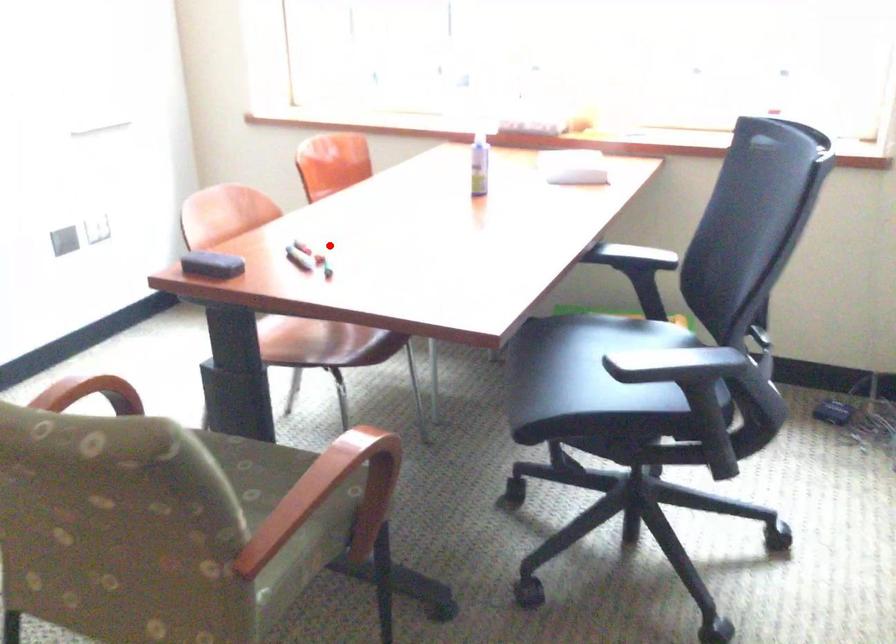
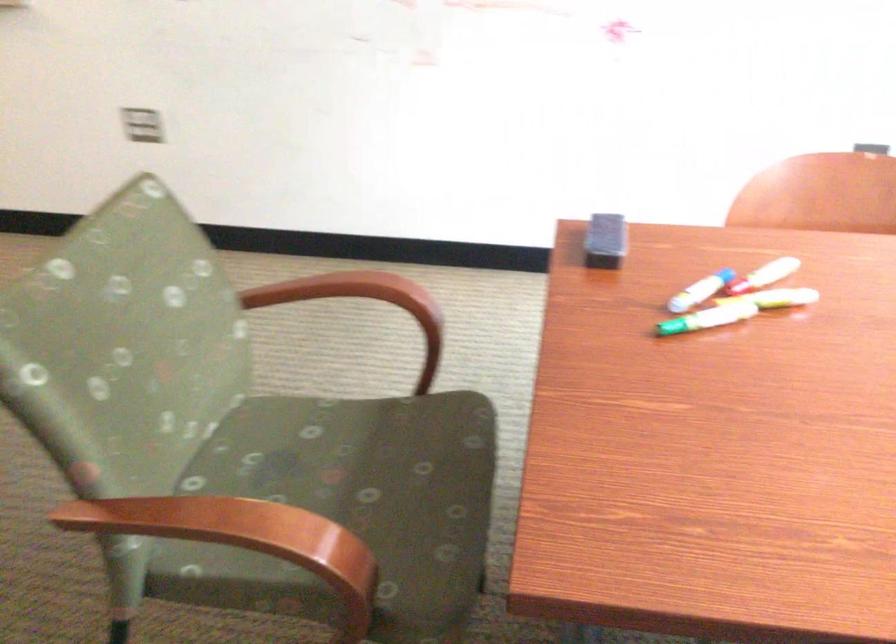
The point at the highlighted location is marked in the first image. Where is the corresponding point in the second image?

(776, 298)